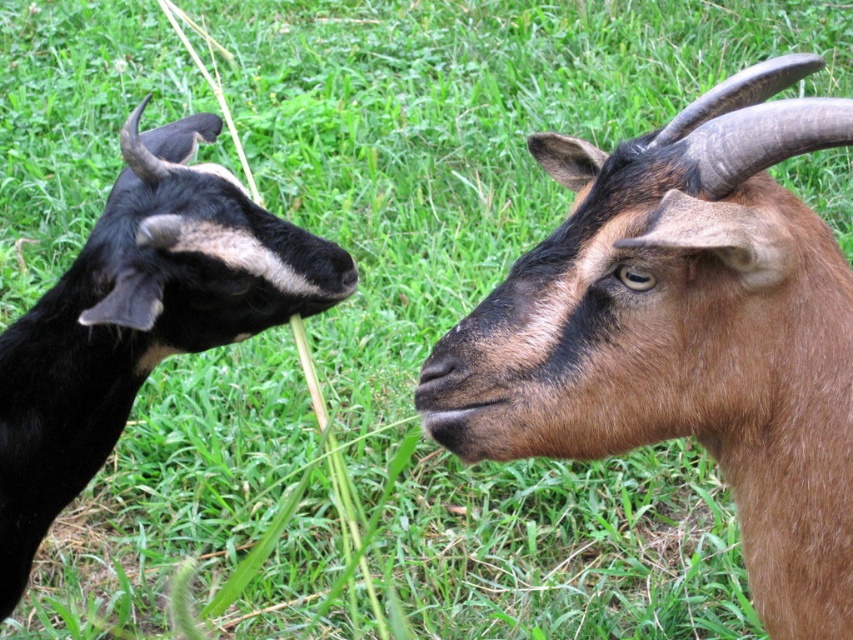
You are a farmer who wants to separate the two goats using a fence. The minimum required distance between the goats and the fence should be 50 centimeters to ensure they can move freely. Given the current distance between the brown furry goat at right and the black fur goat at left, is it possible to place the fence between them without violating the distance requirement?

The brown furry goat at right is 47.10 centimeters from the black fur goat at left. Since the required minimum distance is 50 centimeters, placing a fence between them would not meet the requirement as the existing gap is smaller than needed.

You are a photographer trying to capture a clear photo of both the brown furry goat at right and the black fur goat at left. Since you want both goats to be in focus, which goat should you focus on first to ensure the other is also in focus?

You should focus on the brown furry goat at right first because it is closer to you than the black fur goat at left. By focusing on the closer subject, the farther one will also be in focus if they are within the depth of field range.